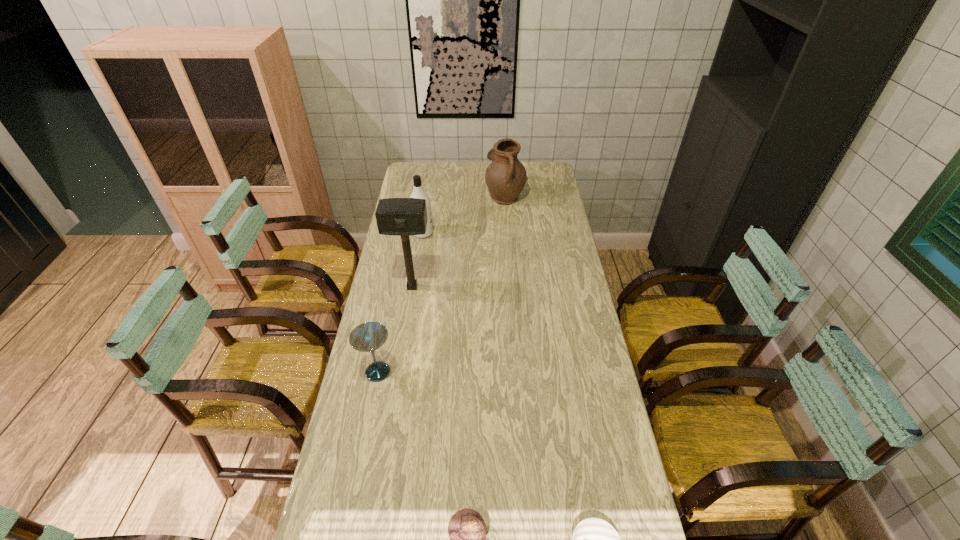
Locate an element on the screen. free point located 0.240m on the front-facing side of the shampoo is located at coordinates (x=487, y=233).

The height and width of the screenshot is (540, 960). Find the location of `vacant space situated on the front of the fourth farthest object`. vacant space situated on the front of the fourth farthest object is located at coordinates (366, 431).

This screenshot has width=960, height=540. Find the location of `object at the far edge`. object at the far edge is located at coordinates (505, 177).

Identify the location of mallet at the left edge. (404, 217).

Locate an element on the screen. This screenshot has width=960, height=540. shampoo located in the left edge section of the desktop is located at coordinates (418, 192).

You are a GUI agent. You are given a task and a screenshot of the screen. Output one action in this format:
    pyautogui.click(x=<x>, y=<y>)
    Task: Click on the martini located at the left edge
    The image size is (960, 540).
    Given the screenshot: What is the action you would take?
    pyautogui.click(x=367, y=337)

In the image, there is a desktop. At what (x,y) coordinates should I click in order to perform the action: click on vacant space at the far edge. Please return your answer as a coordinate pair (x, y). Looking at the image, I should click on (452, 184).

Locate an element on the screen. The height and width of the screenshot is (540, 960). free space at the left edge is located at coordinates (349, 400).

Where is `free space at the right edge`? The width and height of the screenshot is (960, 540). free space at the right edge is located at coordinates (569, 248).

You are a GUI agent. You are given a task and a screenshot of the screen. Output one action in this format:
    pyautogui.click(x=<x>, y=<y>)
    Task: Click on the free spot between the shampoo and the pitcher
    
    Given the screenshot: What is the action you would take?
    pyautogui.click(x=464, y=214)